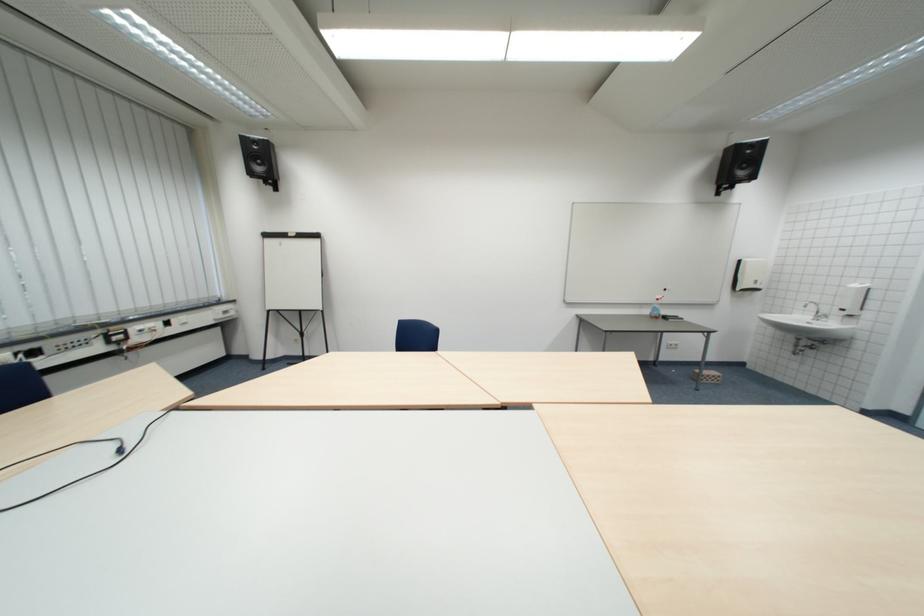
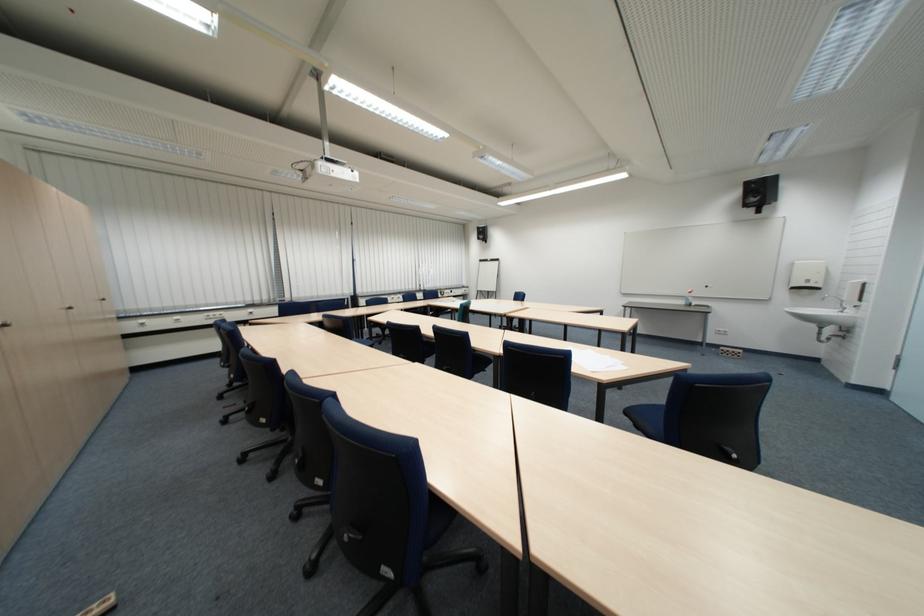
Find the pixel in the second image that matches the point at 758,292 in the first image.

(807, 290)